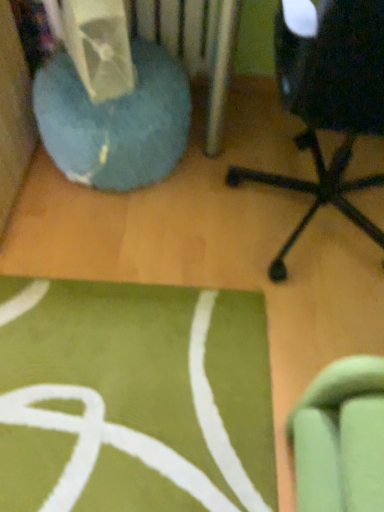
You are a GUI agent. You are given a task and a screenshot of the screen. Output one action in this format:
    pyautogui.click(x=<x>, y=<y>)
    Task: Click on the black plastic chair at right
    The width and height of the screenshot is (384, 512).
    Given the screenshot: What is the action you would take?
    pyautogui.click(x=329, y=104)

Describe the element at coordinates (329, 104) in the screenshot. I see `black plastic chair at right` at that location.

From the picture: What is the approximate height of blue fuzzy bean bag at left?

It is 32.27 centimeters.

This screenshot has height=512, width=384. Find the location of `blue fuzzy bean bag at left`. blue fuzzy bean bag at left is located at coordinates (115, 121).

What do you see at coordinates (115, 121) in the screenshot? The width and height of the screenshot is (384, 512). I see `blue fuzzy bean bag at left` at bounding box center [115, 121].

Where is `black plastic chair at right`? This screenshot has width=384, height=512. black plastic chair at right is located at coordinates (329, 104).

Would you say blue fuzzy bean bag at left is to the left or to the right of black plastic chair at right in the picture?

In the image, blue fuzzy bean bag at left appears on the left side of black plastic chair at right.

Is the position of blue fuzzy bean bag at left more distant than that of black plastic chair at right?

Yes.

Does point (83, 89) come closer to viewer compared to point (376, 75)?

No, it is behind (376, 75).

From the image's perspective, is blue fuzzy bean bag at left located above or below black plastic chair at right?

From the image's perspective, blue fuzzy bean bag at left appears above black plastic chair at right.

From a real-world perspective, which is physically above, blue fuzzy bean bag at left or black plastic chair at right?

black plastic chair at right.

Which of these two, blue fuzzy bean bag at left or black plastic chair at right, is thinner?

blue fuzzy bean bag at left.

Based on the photo, from their relative heights in the image, would you say blue fuzzy bean bag at left is taller or shorter than black plastic chair at right?

In the image, blue fuzzy bean bag at left appears to be shorter than black plastic chair at right.

Based on their sizes in the image, would you say blue fuzzy bean bag at left is bigger or smaller than black plastic chair at right?

blue fuzzy bean bag at left is smaller than black plastic chair at right.

Is blue fuzzy bean bag at left located outside black plastic chair at right?

Yes, blue fuzzy bean bag at left is not within black plastic chair at right.

Is blue fuzzy bean bag at left in contact with black plastic chair at right?

blue fuzzy bean bag at left and black plastic chair at right are clearly separated.

Is blue fuzzy bean bag at left facing towards black plastic chair at right?

No, blue fuzzy bean bag at left does not turn towards black plastic chair at right.

How different are the orientations of blue fuzzy bean bag at left and black plastic chair at right in degrees?

The angle between the facing direction of blue fuzzy bean bag at left and the facing direction of black plastic chair at right is 180 degrees.

How far apart are blue fuzzy bean bag at left and black plastic chair at right?

They are 17.18 inches apart.

In the image, there is a black plastic chair at right. Where is `bean bag chair below it (from a real-world perspective)`? bean bag chair below it (from a real-world perspective) is located at coordinates (115, 121).

Between black plastic chair at right and blue fuzzy bean bag at left, which one appears on the left side from the viewer's perspective?

blue fuzzy bean bag at left is more to the left.

Between black plastic chair at right and blue fuzzy bean bag at left, which one is positioned in front?

black plastic chair at right is closer to the camera.

Considering the positions of point (277, 50) and point (137, 73), is point (277, 50) closer or farther from the camera than point (137, 73)?

Point (277, 50).

From the image's perspective, who appears lower, black plastic chair at right or blue fuzzy bean bag at left?

black plastic chair at right.

From the picture: From a real-world perspective, who is located higher, black plastic chair at right or blue fuzzy bean bag at left?

In real-world perspective, black plastic chair at right is above.

Considering the relative sizes of black plastic chair at right and blue fuzzy bean bag at left in the image provided, is black plastic chair at right thinner than blue fuzzy bean bag at left?

No, black plastic chair at right is not thinner than blue fuzzy bean bag at left.

Is black plastic chair at right taller or shorter than blue fuzzy bean bag at left?

Clearly, black plastic chair at right is taller compared to blue fuzzy bean bag at left.

Which of these two, black plastic chair at right or blue fuzzy bean bag at left, is bigger?

black plastic chair at right.

Is black plastic chair at right outside of blue fuzzy bean bag at left?

That's correct, black plastic chair at right is outside of blue fuzzy bean bag at left.

Are black plastic chair at right and blue fuzzy bean bag at left beside each other?

No.

Does black plastic chair at right turn towards blue fuzzy bean bag at left?

No, black plastic chair at right is not oriented towards blue fuzzy bean bag at left.

How much distance is there between black plastic chair at right and blue fuzzy bean bag at left?

They are 17.18 inches apart.

This screenshot has height=512, width=384. Find the location of `bean bag chair on the left of black plastic chair at right`. bean bag chair on the left of black plastic chair at right is located at coordinates (115, 121).

What are the coordinates of `chair on the right of the blue fuzzy bean bag at left` in the screenshot? It's located at (329, 104).

You are a GUI agent. You are given a task and a screenshot of the screen. Output one action in this format:
    pyautogui.click(x=<x>, y=<y>)
    Task: Click on the chair lying below the blue fuzzy bean bag at left (from the image's perspective)
    
    Given the screenshot: What is the action you would take?
    (329, 104)